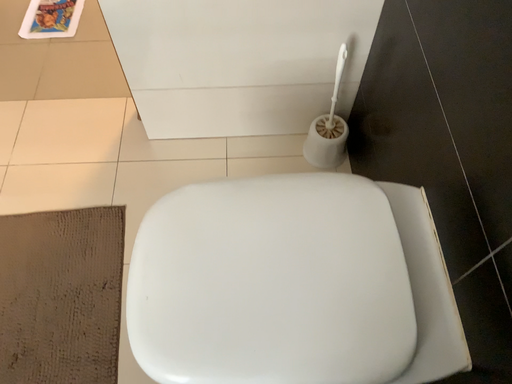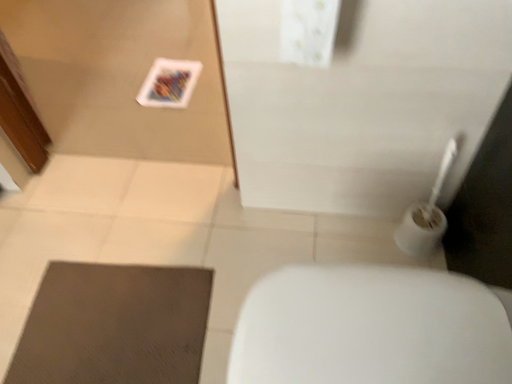
Question: How did the camera likely rotate when shooting the video?

Choices:
 (A) rotated downward
 (B) rotated upward

Answer: (B)